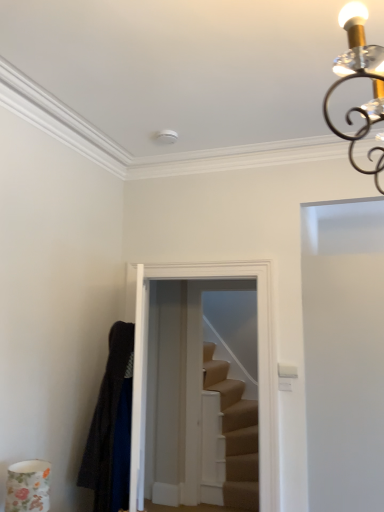
Question: From the image's perspective, is dark woolen robe at left positioned above or below white matte door at right?

Choices:
 (A) below
 (B) above

Answer: (B)

Question: Is point (125, 450) closer or farther from the camera than point (359, 330)?

Choices:
 (A) farther
 (B) closer

Answer: (B)

Question: Which object is the closest to the beige carpeted stairs at center?

Choices:
 (A) white matte door at right
 (B) dark woolen robe at left
 (C) clear glass door at center

Answer: (C)

Question: Which object is positioned closest to the beige carpeted stairs at center?

Choices:
 (A) white matte door at right
 (B) clear glass door at center
 (C) dark woolen robe at left

Answer: (B)